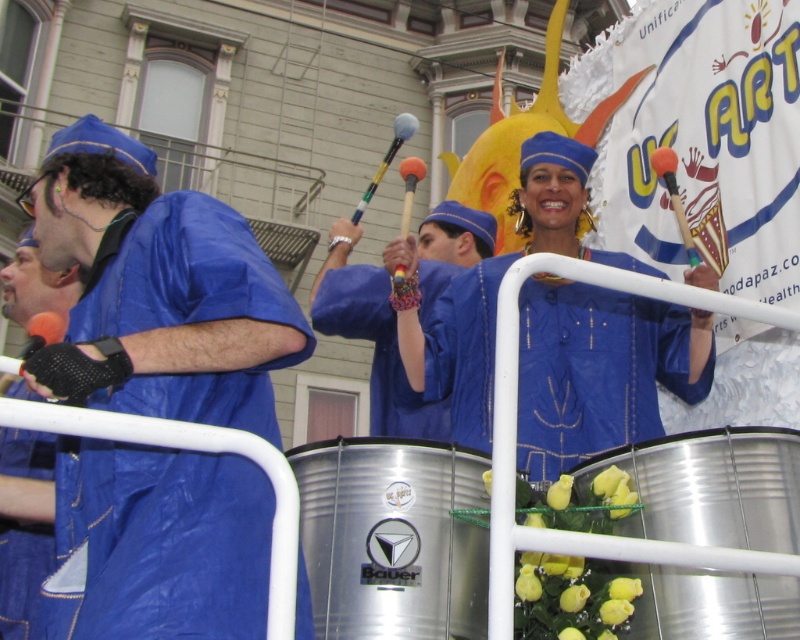
I want to click on matte blue shirt at left, so click(158, 291).

Which of these two, matte blue shirt at left or blue shiny fabric at center, stands taller?

With more height is matte blue shirt at left.

Is point (62, 634) closer to viewer compared to point (612, 371)?

Yes, it is.

You are a GUI agent. You are given a task and a screenshot of the screen. Output one action in this format:
    pyautogui.click(x=<x>, y=<y>)
    Task: Click on the matte blue shirt at left
    This screenshot has width=800, height=640.
    Given the screenshot: What is the action you would take?
    pyautogui.click(x=158, y=291)

Looking at this image, does silver metallic drum at center have a greater width compared to blue fabric drumstick at center?

In fact, silver metallic drum at center might be narrower than blue fabric drumstick at center.

Is silver metallic drum at center positioned before blue fabric drumstick at center?

Yes, it is.

Where is `silver metallic drum at center`? Image resolution: width=800 pixels, height=640 pixels. silver metallic drum at center is located at coordinates (392, 538).

Who is taller, blue shiny fabric at center or silver metallic drum at lower right?

With more height is blue shiny fabric at center.

Can you confirm if blue shiny fabric at center is positioned below silver metallic drum at lower right?

No, blue shiny fabric at center is not below silver metallic drum at lower right.

The image size is (800, 640). Describe the element at coordinates (600, 369) in the screenshot. I see `blue shiny fabric at center` at that location.

I want to click on blue shiny fabric at center, so click(x=600, y=369).